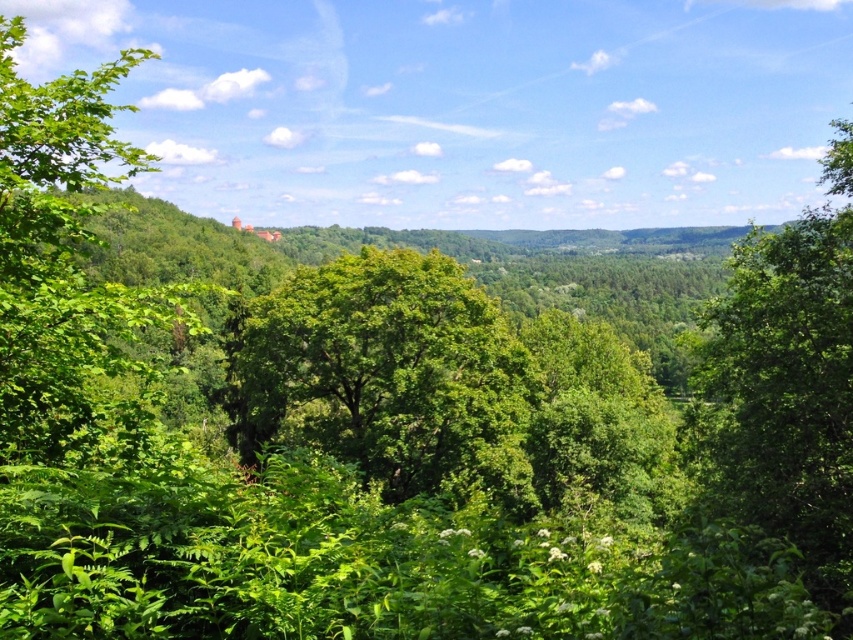
Question: Is green leafy tree at left below green leafy tree at right?

Choices:
 (A) yes
 (B) no

Answer: (B)

Question: From the image, what is the correct spatial relationship of green leafy tree at left in relation to green leafy tree at right?

Choices:
 (A) right
 (B) left

Answer: (B)

Question: Can you confirm if green leafy tree at left is positioned above green leafy tree at right?

Choices:
 (A) no
 (B) yes

Answer: (B)

Question: Which of these objects is positioned closest to the green leafy tree at right?

Choices:
 (A) green leafy tree at left
 (B) green leafy tree at center

Answer: (B)

Question: Among these objects, which one is farthest from the camera?

Choices:
 (A) green leafy tree at left
 (B) green leafy tree at right

Answer: (A)

Question: Which point appears farthest from the camera in this image?

Choices:
 (A) (399, 401)
 (B) (78, 84)

Answer: (A)